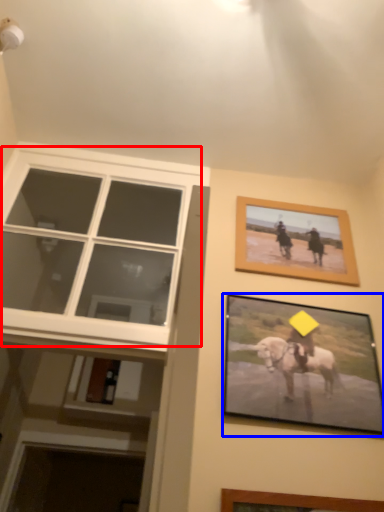
Question: Which object appears closest to the camera in this image, window (highlighted by a red box) or picture frame (highlighted by a blue box)?

Choices:
 (A) window
 (B) picture frame

Answer: (B)